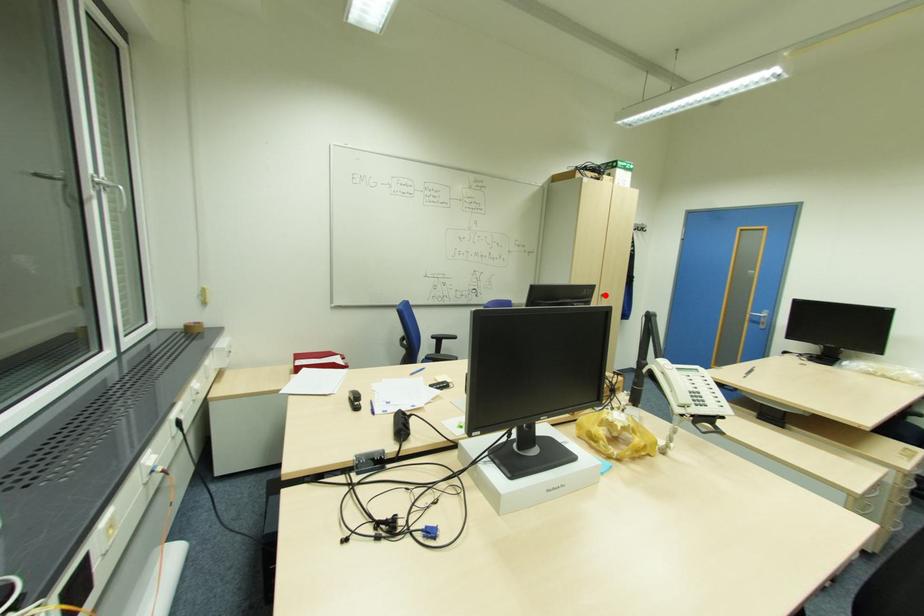
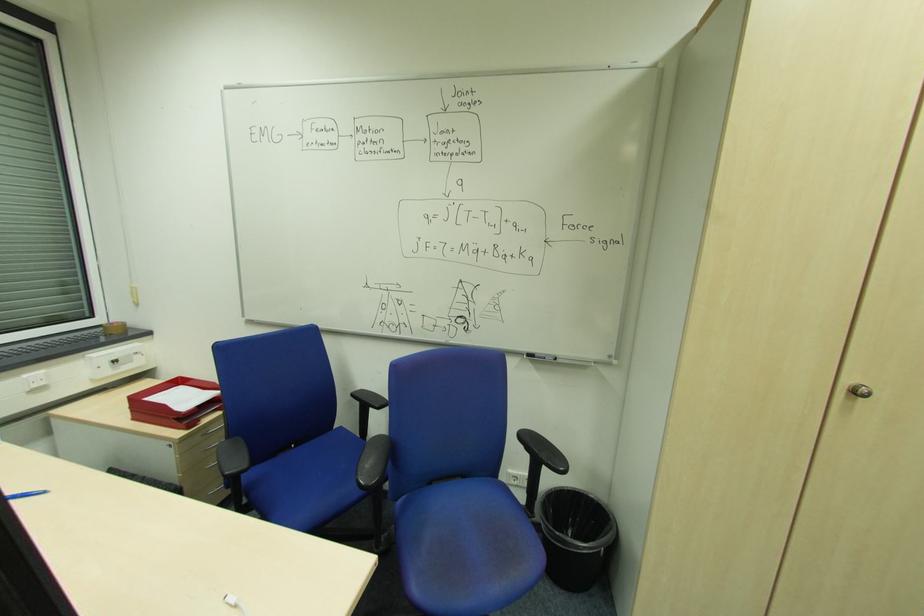
Question: I am providing you with two images of the same scene from different viewpoints. A red point is shown in image1. For the corresponding object point in image2, is it positioned nearer or farther from the camera?

Choices:
 (A) Nearer
 (B) Farther

Answer: (A)